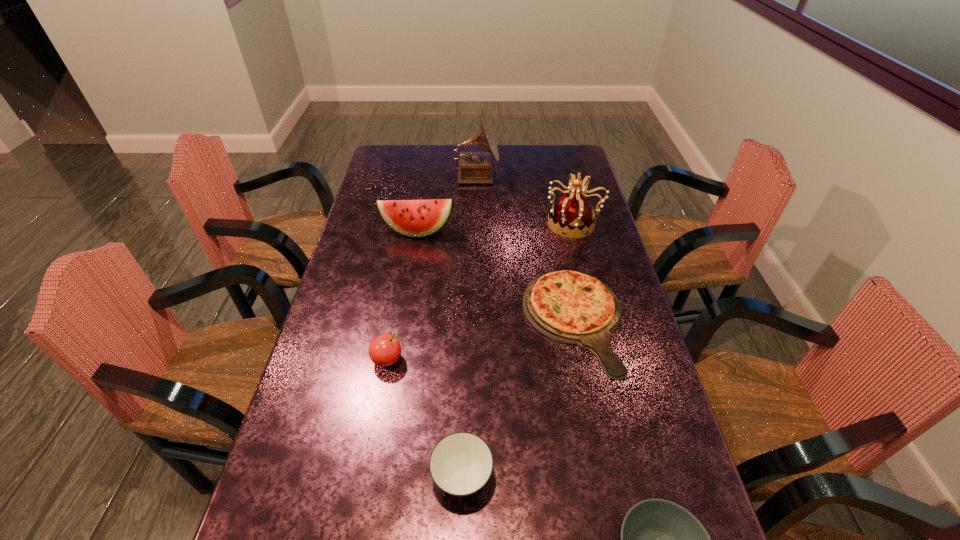
What are the coordinates of `free space located on the front-facing side of the second tallest object` in the screenshot? It's located at (497, 223).

The height and width of the screenshot is (540, 960). I want to click on vacant area situated on the front-facing side of the second tallest object, so click(464, 223).

You are a GUI agent. You are given a task and a screenshot of the screen. Output one action in this format:
    pyautogui.click(x=<x>, y=<y>)
    Task: Click on the vacant space located 0.110m on the outer rind of the watermelon
    
    Given the screenshot: What is the action you would take?
    pyautogui.click(x=412, y=262)

What are the coordinates of `vacant space located 0.400m on the right of the apple` in the screenshot? It's located at (556, 360).

Find the location of a particular element. This screenshot has height=540, width=960. free spot located on the left of the left soup bowl is located at coordinates (309, 477).

Where is `vacant space located on the back of the shortest object`? The image size is (960, 540). vacant space located on the back of the shortest object is located at coordinates click(x=562, y=259).

Where is `object that is positioned at the far edge`? The width and height of the screenshot is (960, 540). object that is positioned at the far edge is located at coordinates (474, 167).

The image size is (960, 540). What are the coordinates of `watermelon located in the left edge section of the desktop` in the screenshot? It's located at (415, 218).

Where is `apple that is at the left edge`? Image resolution: width=960 pixels, height=540 pixels. apple that is at the left edge is located at coordinates (385, 350).

You are a GUI agent. You are given a task and a screenshot of the screen. Output one action in this format:
    pyautogui.click(x=<x>, y=<y>)
    Task: Click on the tiara located at the right edge
    The height and width of the screenshot is (540, 960).
    Given the screenshot: What is the action you would take?
    pyautogui.click(x=573, y=215)